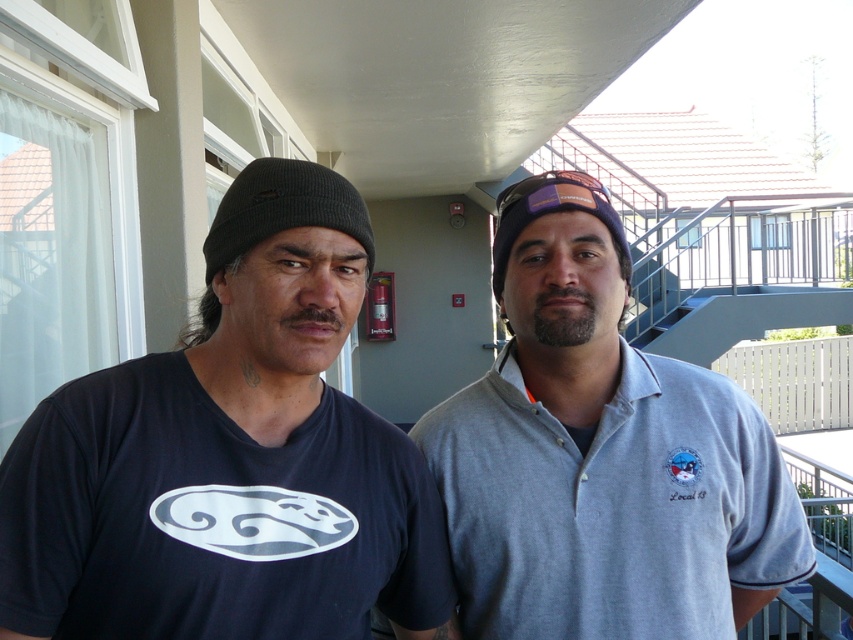
You are a photographer trying to frame a shot of the black knit cap at left and the dark blue T shirt with face graphic on the left person. Where should you position your camera relative to the subjects to ensure both items are in the frame?

The black knit cap at left is positioned at point (283, 209), so you should position your camera to include the coordinates of the black knit cap at left and the dark blue T shirt with face graphic on the left person in the frame.

You are a tailor who needs to determine which item, the gray cotton polo shirt at center or the purple fabric cap at center, requires more fabric to make. Based on the description, which one would need more material?

The gray cotton polo shirt at center requires more fabric because it has a larger size compared to the purple fabric cap at center.